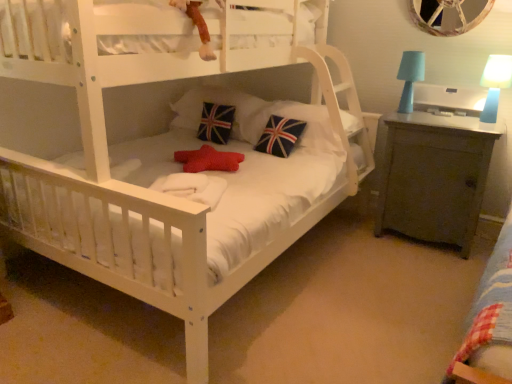
Question: From the image's perspective, is union jack fabric pillow at center, acting as the 3th pillow starting from the right, located beneath matte gray cabinet at right?

Choices:
 (A) yes
 (B) no

Answer: (B)

Question: Considering the relative sizes of union jack fabric pillow at center, which ranks as the 1th pillow in left-to-right order, and matte gray cabinet at right in the image provided, is union jack fabric pillow at center, which ranks as the 1th pillow in left-to-right order, smaller than matte gray cabinet at right?

Choices:
 (A) no
 (B) yes

Answer: (B)

Question: Considering the relative sizes of union jack fabric pillow at center, acting as the 3th pillow starting from the right, and matte gray cabinet at right in the image provided, is union jack fabric pillow at center, acting as the 3th pillow starting from the right, shorter than matte gray cabinet at right?

Choices:
 (A) yes
 (B) no

Answer: (A)

Question: Is union jack fabric pillow at center, acting as the 3th pillow starting from the right, positioned before matte gray cabinet at right?

Choices:
 (A) yes
 (B) no

Answer: (B)

Question: Is union jack fabric pillow at center, acting as the 3th pillow starting from the right, turned away from matte gray cabinet at right?

Choices:
 (A) yes
 (B) no

Answer: (B)

Question: From a real-world perspective, is union jack fabric pillow at center, acting as the 3th pillow starting from the right, positioned under matte gray cabinet at right based on gravity?

Choices:
 (A) yes
 (B) no

Answer: (B)

Question: Is blue plastic table lamp at upper right, placed as the first table lamp when sorted from right to left, smaller than matte gray cabinet at right?

Choices:
 (A) no
 (B) yes

Answer: (B)

Question: Would you say matte gray cabinet at right is part of blue plastic table lamp at upper right, which ranks as the second table lamp in left-to-right order,'s contents?

Choices:
 (A) no
 (B) yes

Answer: (A)

Question: Is blue plastic table lamp at upper right, placed as the first table lamp when sorted from right to left, looking in the opposite direction of matte gray cabinet at right?

Choices:
 (A) no
 (B) yes

Answer: (A)

Question: Are blue plastic table lamp at upper right, which ranks as the second table lamp in left-to-right order, and matte gray cabinet at right making contact?

Choices:
 (A) yes
 (B) no

Answer: (B)

Question: From the image's perspective, is blue plastic table lamp at upper right, which ranks as the second table lamp in left-to-right order, located beneath matte gray cabinet at right?

Choices:
 (A) no
 (B) yes

Answer: (A)

Question: From a real-world perspective, is blue plastic table lamp at upper right, placed as the first table lamp when sorted from right to left, located beneath matte gray cabinet at right?

Choices:
 (A) yes
 (B) no

Answer: (B)

Question: Is velvety plush monkey at upper center touching matte gray cabinet at right?

Choices:
 (A) yes
 (B) no

Answer: (B)